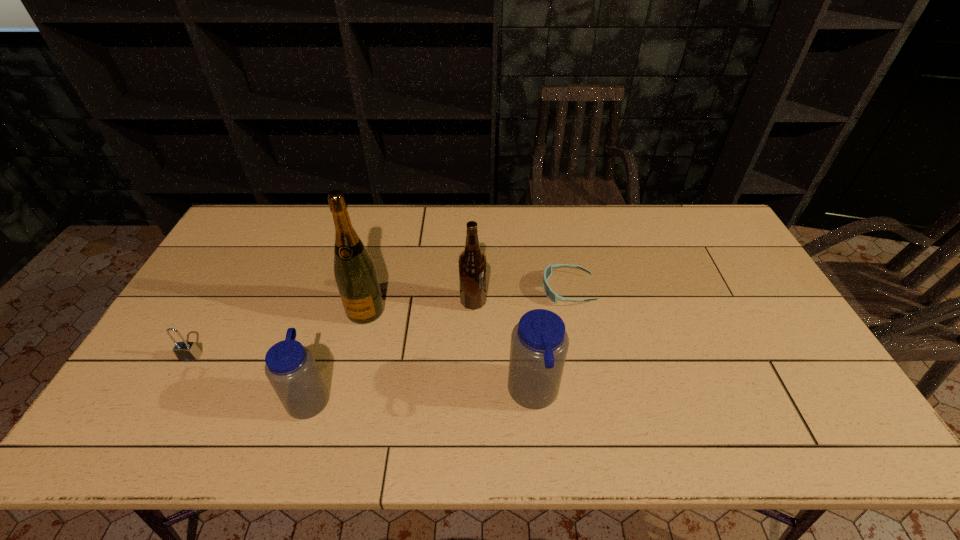
Observe the arrangement of all water bottles in the image. To keep them evenly spaced, where would you place another water bottle on the right? Please locate a free space. Please provide its 2D coordinates. Your answer should be formatted as a tuple, i.e. [(x, y)], where the tuple contains the x and y coordinates of a point satisfying the conditions above.

[(755, 391)]